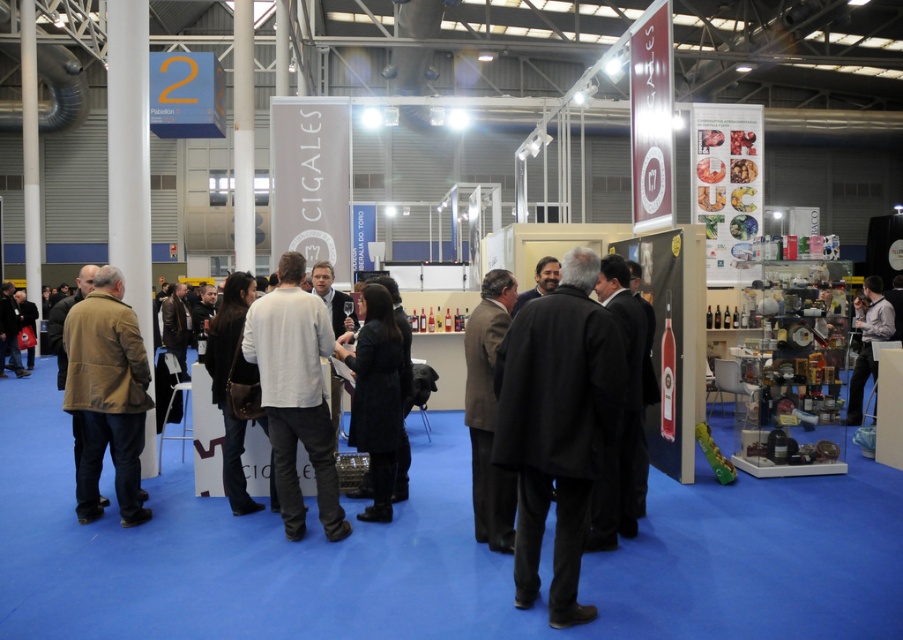
Question: Is dark wool coat at center thinner than brown suede jacket at left?

Choices:
 (A) no
 (B) yes

Answer: (B)

Question: Considering the real-world distances, which object is closest to the black leather coat at center?

Choices:
 (A) gray fabric shirt at right
 (B) brown suede jacket at left
 (C) white cotton shirt at center
 (D) dark wool coat at center

Answer: (C)

Question: Which object appears farthest from the camera in this image?

Choices:
 (A) gray fabric shirt at right
 (B) light brown wool coat at center
 (C) dark wool coat at center
 (D) brown suede jacket at left

Answer: (A)

Question: Can you confirm if brown suede jacket at left is bigger than gray fabric shirt at right?

Choices:
 (A) no
 (B) yes

Answer: (A)

Question: Can you confirm if brown suede jacket at left is smaller than light brown wool coat at center?

Choices:
 (A) yes
 (B) no

Answer: (B)

Question: Among these objects, which one is nearest to the camera?

Choices:
 (A) brown suede jacket at left
 (B) gray fabric shirt at right
 (C) dark wool coat at center
 (D) white cotton shirt at center

Answer: (C)